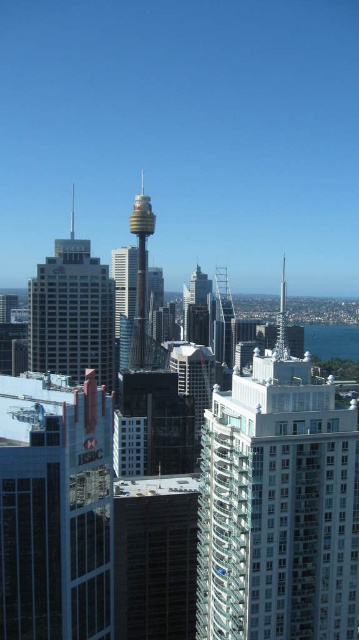
You are standing in the cityscape and want to determine which of the two points, point (57,568) or point (62,280), is nearer to you. Based on the scene, which point is closer?

Point (57,568) is closer to the viewer than point (62,280).

You are standing at the point marked as point (x=54, y=508) in the cityscape. Looking around, you see the glassy reflective building at center. Which direction should you face to see the glassy reflective building at center?

You should face the center direction to see the glassy reflective building at center located at point (x=54, y=508).

What are the coordinates of the glassy reflective building at center?

The glassy reflective building at center is located at coordinates point (54, 508).